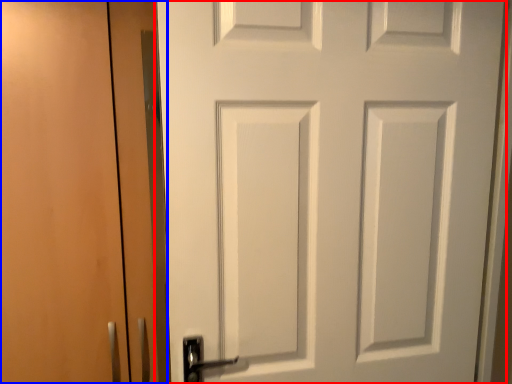
Question: Which of the following is the farthest to the observer, door (highlighted by a red box) or garage door (highlighted by a blue box)?

Choices:
 (A) door
 (B) garage door

Answer: (B)